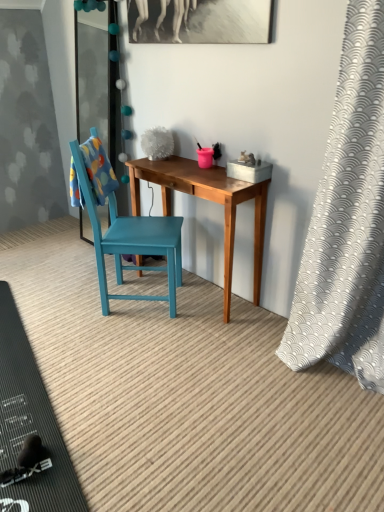
At what (x,y) coordinates should I click in order to perform the action: click on vacant area that lies between white textured curtain at right and teal wooden chair at center. Please return your answer as a coordinate pair (x, y). Image resolution: width=384 pixels, height=512 pixels. Looking at the image, I should click on (226, 342).